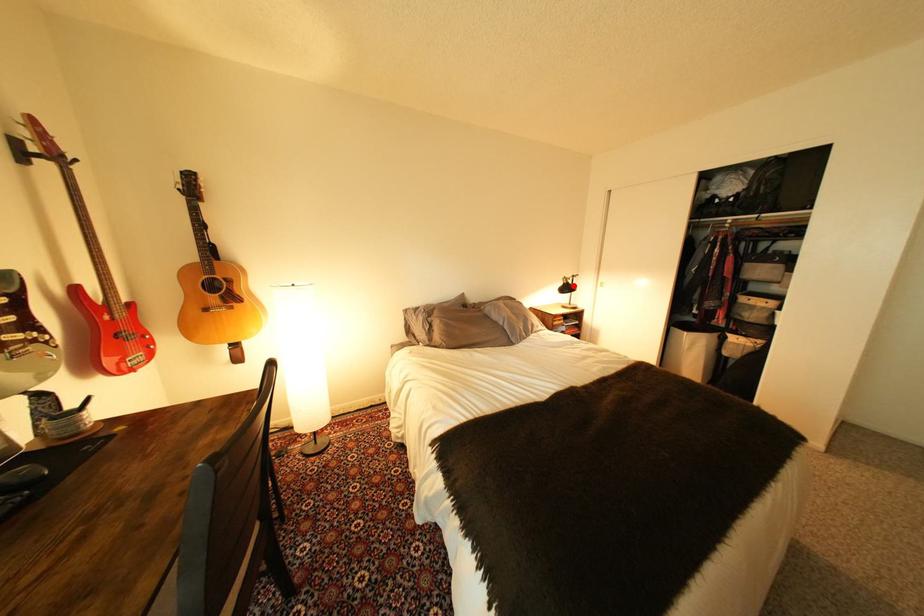
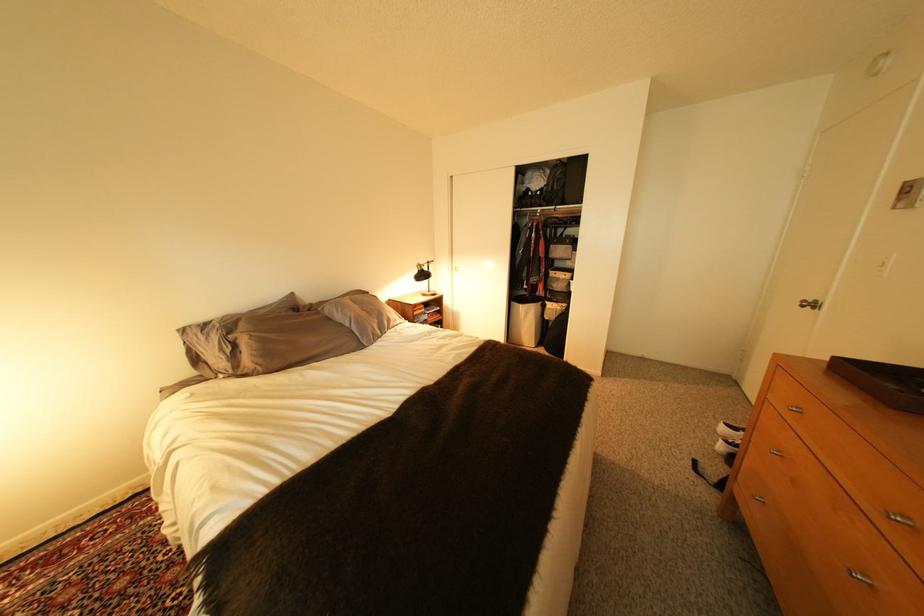
Where in the second image is the point corresponding to the highlighted location from the first image?

(429, 273)